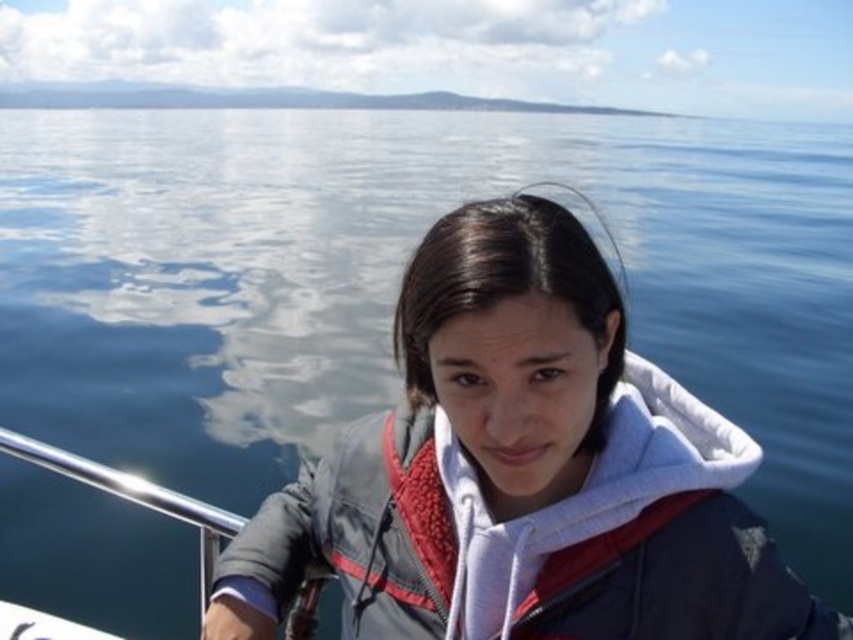
Does point (583, 429) come behind point (36, 452)?

No, (583, 429) is closer to viewer.

Which is behind, point (497, 310) or point (117, 468)?

Positioned behind is point (117, 468).

This screenshot has height=640, width=853. Describe the element at coordinates (517, 474) in the screenshot. I see `white fleece jacket at center` at that location.

This screenshot has width=853, height=640. I want to click on white fleece jacket at center, so click(x=517, y=474).